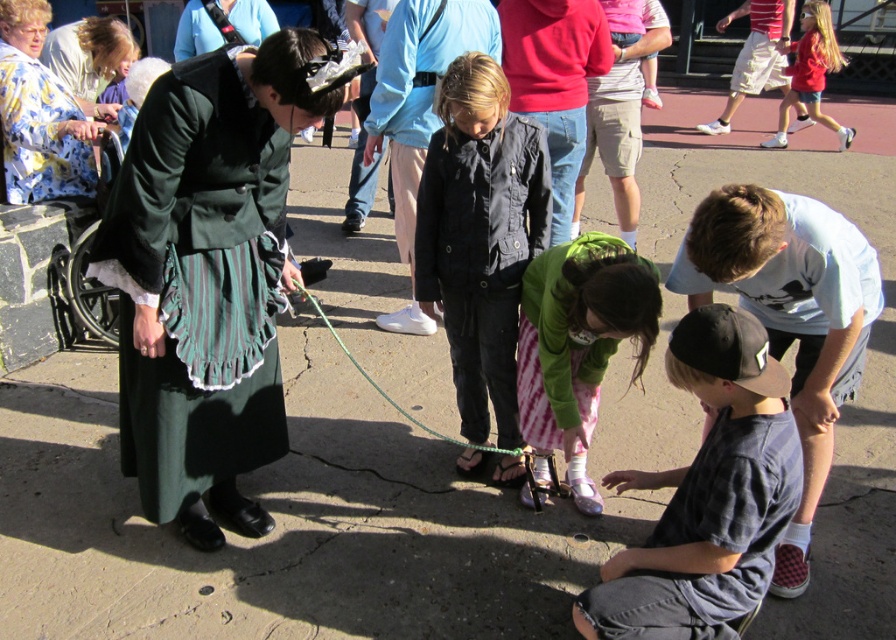
Question: Which point is farther to the camera?

Choices:
 (A) floral silk robe at upper left
 (B) dark blue cotton shirt at lower right

Answer: (A)

Question: Where is green velvet robe at left located in relation to dark blue cotton shirt at lower right in the image?

Choices:
 (A) left
 (B) right

Answer: (A)

Question: Which object is positioned closest to the floral silk robe at upper left?

Choices:
 (A) black matte jacket at center
 (B) green velvet robe at left
 (C) dark blue cotton shirt at lower right

Answer: (B)

Question: Based on their relative distances, which object is farther from the green rubber rope at center?

Choices:
 (A) dark blue cotton shirt at lower right
 (B) floral silk robe at upper left

Answer: (B)

Question: Is dark blue cotton shirt at lower right further to camera compared to green rubber rope at center?

Choices:
 (A) no
 (B) yes

Answer: (A)

Question: Is dark blue cotton shirt at lower right wider than light blue t-shirt at lower right?

Choices:
 (A) yes
 (B) no

Answer: (B)